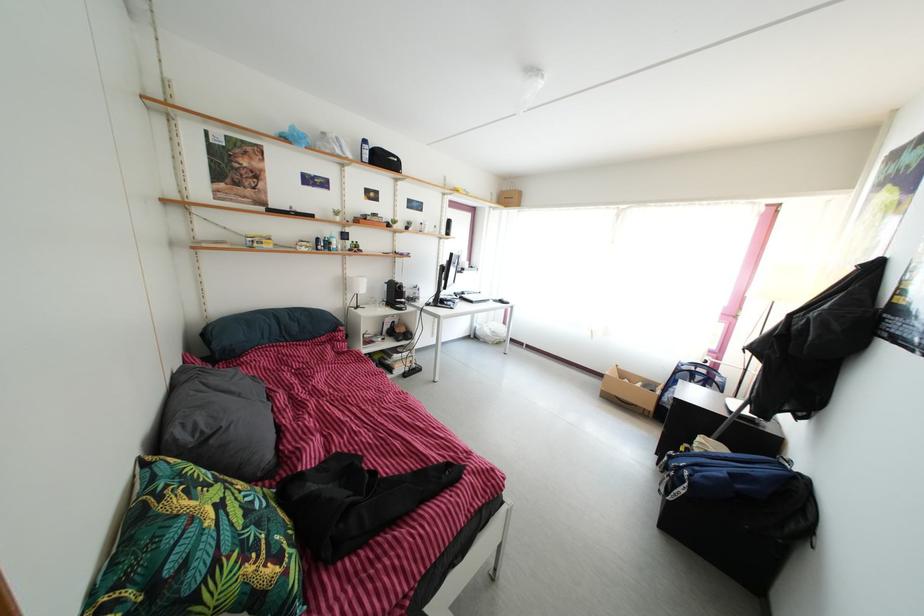
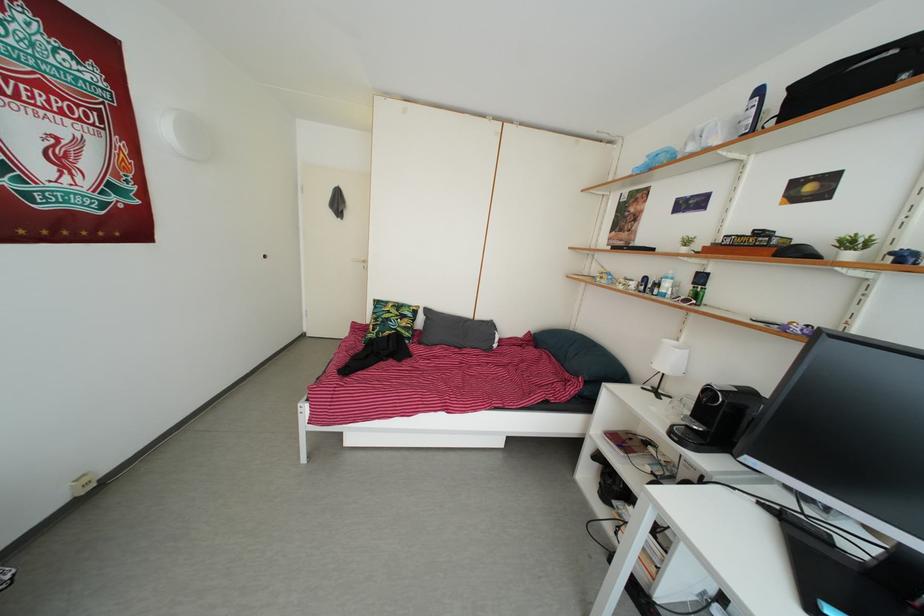
Where in the second image is the point corresponding to point 264,533 from the first image?

(388, 330)